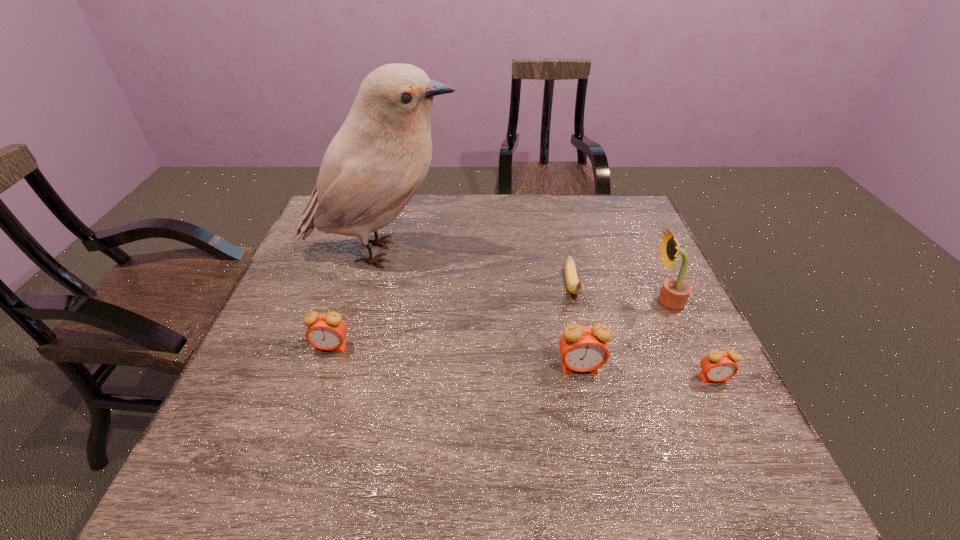
Locate an element on the screen. alarm clock that is the closest one to the third tallest object is located at coordinates (718, 365).

This screenshot has height=540, width=960. Find the location of `vacant space that satisfies the following two spatial constraints: 1. on the face of the sunflower; 2. on the face of the third shortest object`. vacant space that satisfies the following two spatial constraints: 1. on the face of the sunflower; 2. on the face of the third shortest object is located at coordinates (684, 347).